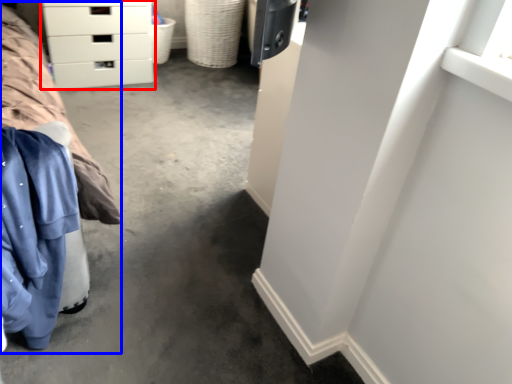
Question: Among these objects, which one is farthest to the camera, chest of drawers (highlighted by a red box) or bed (highlighted by a blue box)?

Choices:
 (A) chest of drawers
 (B) bed

Answer: (A)